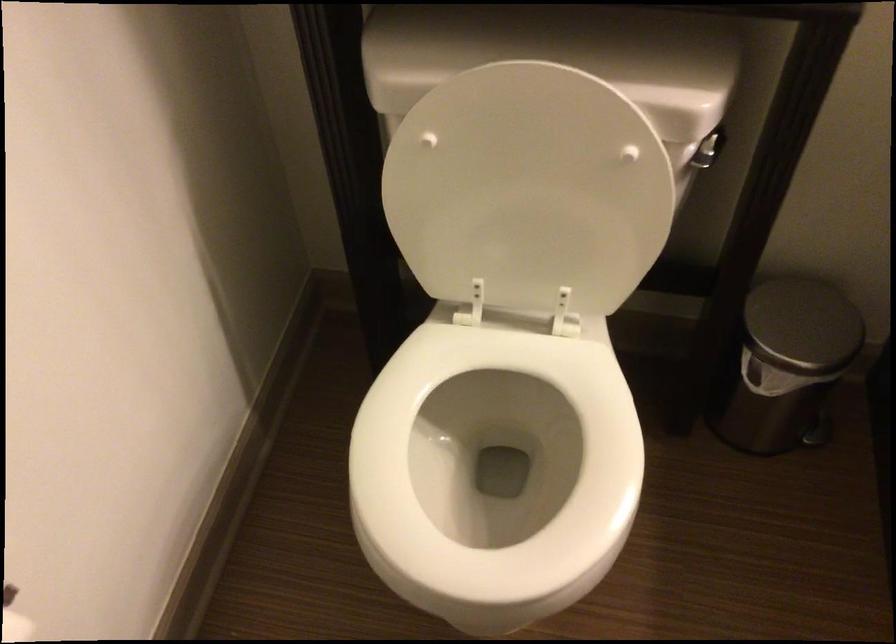
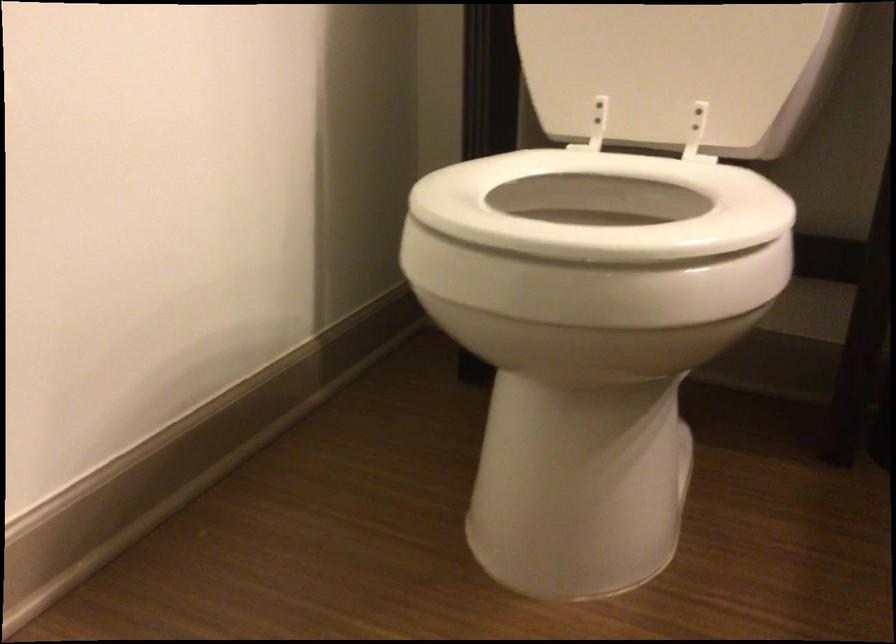
In the second image, find the point that corresponds to point 492,365 in the first image.

(602, 205)